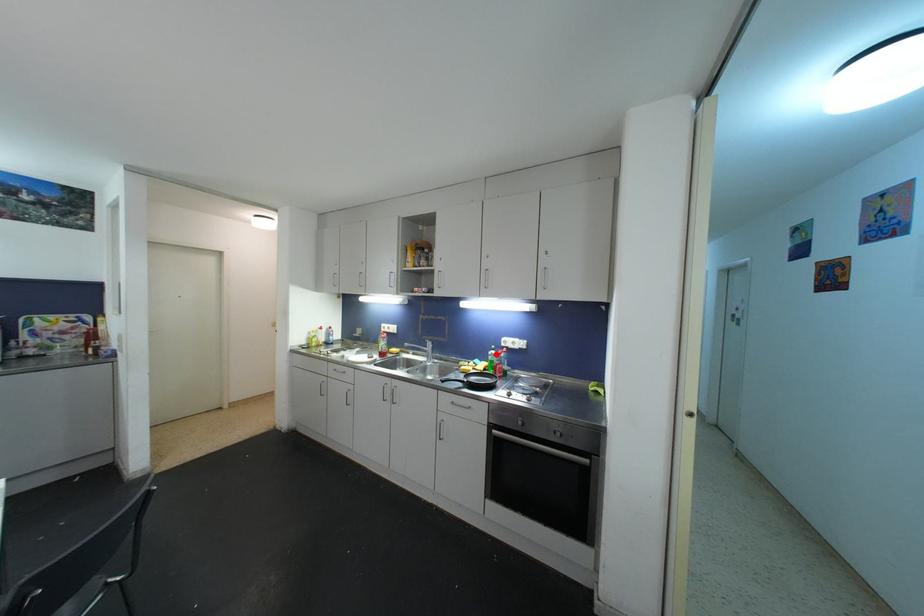
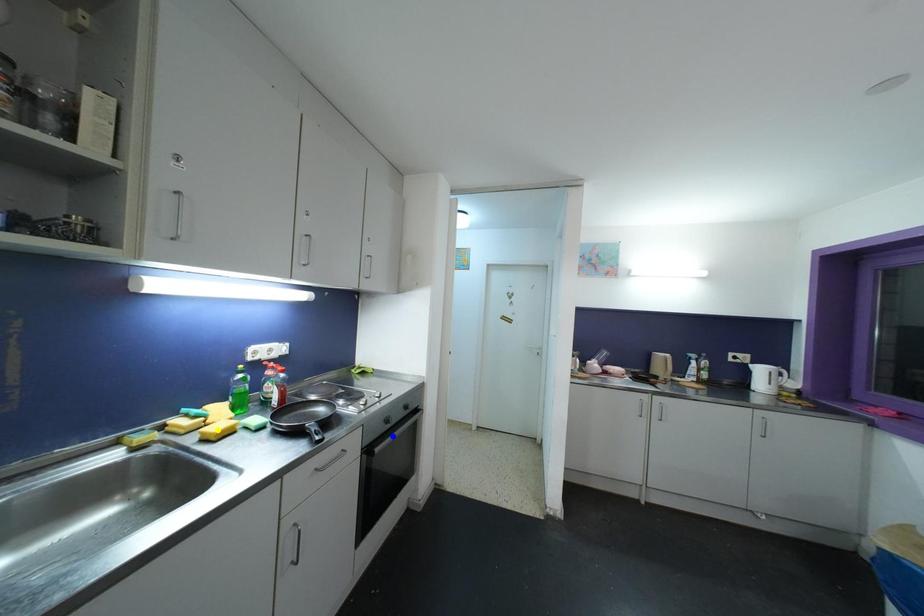
Question: I am providing you with two images of the same scene from different viewpoints. A red point is marked on the first image. You are given multiple points on the second image. Which spot in image 2 lines up with the point in image 1?

Choices:
 (A) blue point
 (B) yellow point
 (C) green point

Answer: (C)